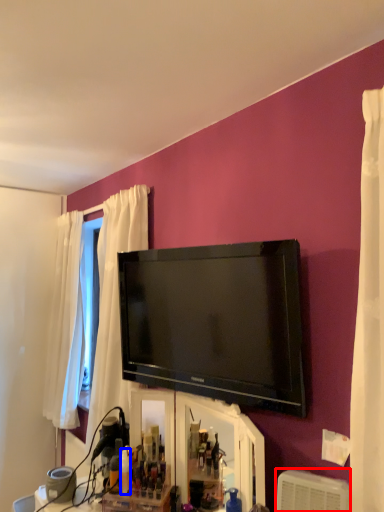
Question: Which of the following is the farthest to the observer, air conditioner (highlighted by a red box) or toiletry (highlighted by a blue box)?

Choices:
 (A) air conditioner
 (B) toiletry

Answer: (B)